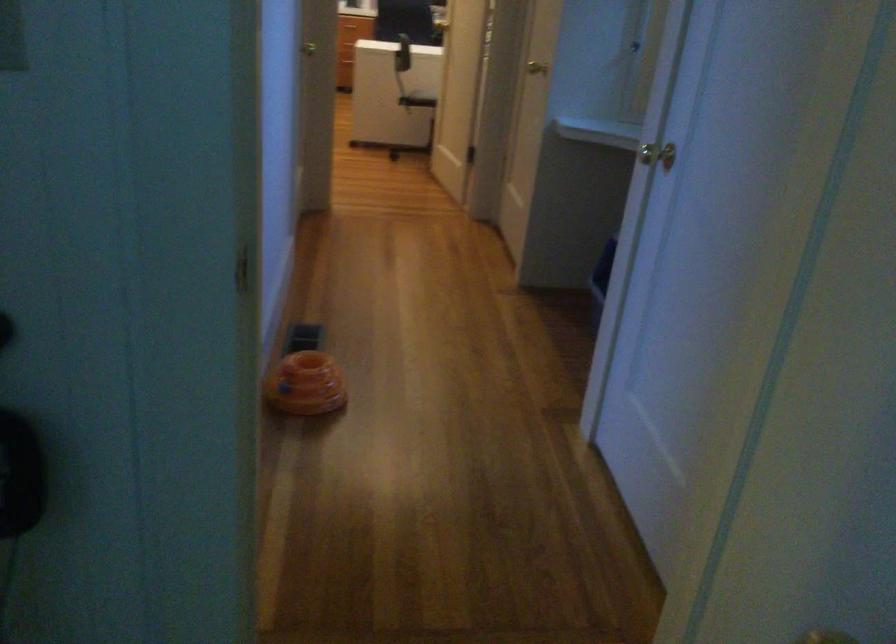
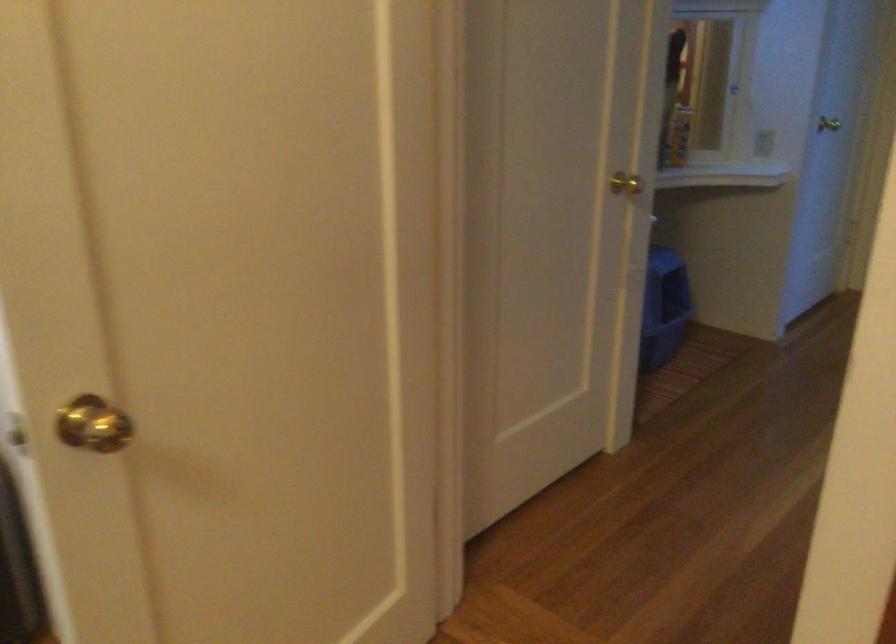
Find the pixel in the second image that matches (x=549, y=67) in the first image.

(625, 184)